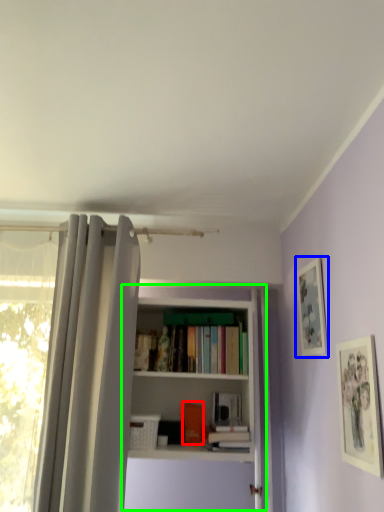
Question: Which object is positioned closest to book (highlighted by a red box)? Select from picture frame (highlighted by a blue box) and bookcase (highlighted by a green box).

Choices:
 (A) picture frame
 (B) bookcase

Answer: (B)